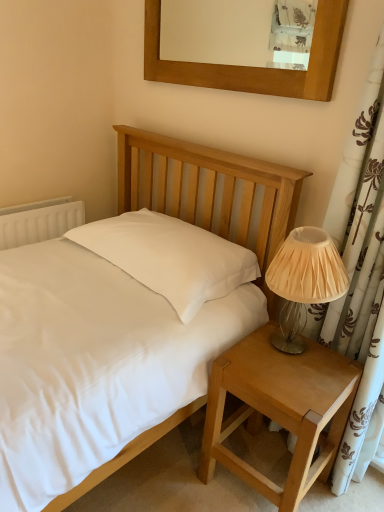
Question: Considering the relative sizes of matte white bed at center and light brown wood nightstand at lower right in the image provided, is matte white bed at center bigger than light brown wood nightstand at lower right?

Choices:
 (A) no
 (B) yes

Answer: (B)

Question: Is matte white bed at center aimed at light brown wood nightstand at lower right?

Choices:
 (A) yes
 (B) no

Answer: (A)

Question: Does matte white bed at center have a greater height compared to light brown wood nightstand at lower right?

Choices:
 (A) no
 (B) yes

Answer: (B)

Question: Is matte white bed at center oriented away from light brown wood nightstand at lower right?

Choices:
 (A) yes
 (B) no

Answer: (B)

Question: Does matte white bed at center appear on the left side of light brown wood nightstand at lower right?

Choices:
 (A) no
 (B) yes

Answer: (B)

Question: From the image's perspective, would you say matte white bed at center is positioned over light brown wood nightstand at lower right?

Choices:
 (A) yes
 (B) no

Answer: (A)

Question: From the image's perspective, is wooden picture frame at upper center below ivory pleated fabric lampshade at right?

Choices:
 (A) no
 (B) yes

Answer: (A)

Question: From a real-world perspective, is wooden picture frame at upper center physically above ivory pleated fabric lampshade at right?

Choices:
 (A) yes
 (B) no

Answer: (A)

Question: Is ivory pleated fabric lampshade at right located within wooden picture frame at upper center?

Choices:
 (A) no
 (B) yes

Answer: (A)

Question: Is wooden picture frame at upper center with ivory pleated fabric lampshade at right?

Choices:
 (A) yes
 (B) no

Answer: (B)

Question: From a real-world perspective, is wooden picture frame at upper center located beneath ivory pleated fabric lampshade at right?

Choices:
 (A) no
 (B) yes

Answer: (A)

Question: Is wooden picture frame at upper center shorter than ivory pleated fabric lampshade at right?

Choices:
 (A) yes
 (B) no

Answer: (A)

Question: Is white plastic radiator at left outside of light brown wood nightstand at lower right?

Choices:
 (A) no
 (B) yes

Answer: (B)